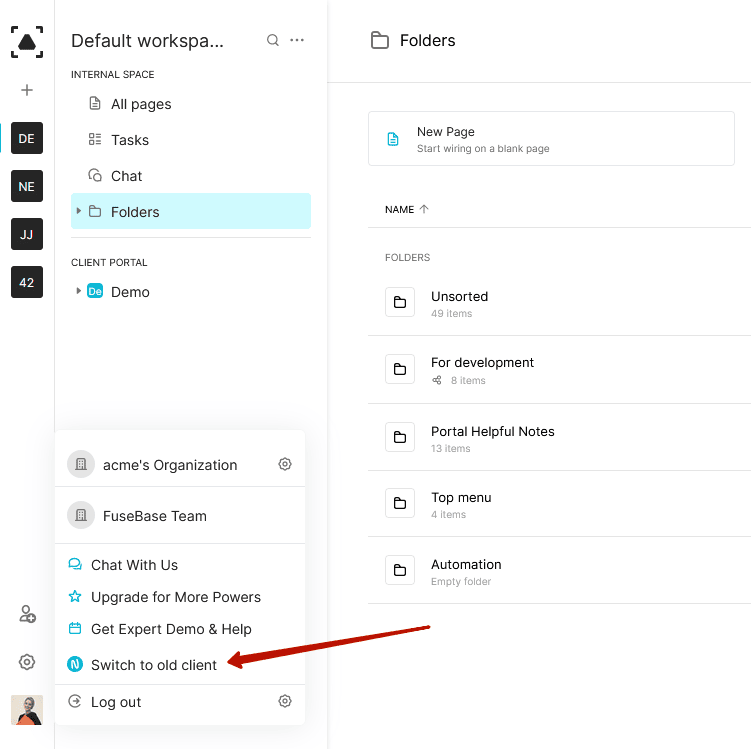
At what (x,y) coordinates should I click in order to perform the action: click on default workspace. Please return your answer as a coordinate pair (x, y). The image size is (751, 749). Looking at the image, I should click on (x=167, y=39).